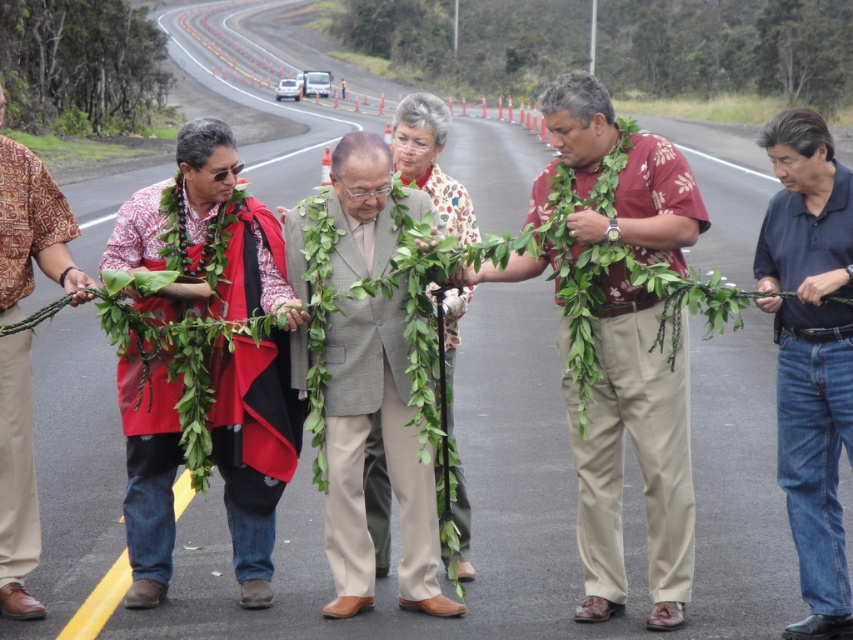
Is point (152, 262) positioned before point (749, 122)?

Yes, point (152, 262) is in front of point (749, 122).

Can you confirm if matte red shawl at center is positioned above green leafy plant at center?

Actually, matte red shawl at center is below green leafy plant at center.

Which is in front, point (258, 257) or point (637, 102)?

Positioned in front is point (258, 257).

Locate an element on the screen. matte red shawl at center is located at coordinates (228, 320).

Who is higher up, printed fabric shirt at center or dark blue shirt at center?

dark blue shirt at center is above.

Is printed fabric shirt at center positioned in front of dark blue shirt at center?

That is False.

Measure the distance between point (x=605, y=387) and camera.

They are 6.36 meters apart.

Where is `printed fabric shirt at center`? The width and height of the screenshot is (853, 640). printed fabric shirt at center is located at coordinates (635, 452).

Can you confirm if gray suit at center is bigger than dark blue shirt at center?

Indeed, gray suit at center has a larger size compared to dark blue shirt at center.

Which is in front, point (392, 472) or point (817, 202)?

Point (817, 202) is in front.

What do you see at coordinates (384, 456) in the screenshot? This screenshot has width=853, height=640. I see `gray suit at center` at bounding box center [384, 456].

I want to click on gray suit at center, so click(384, 456).